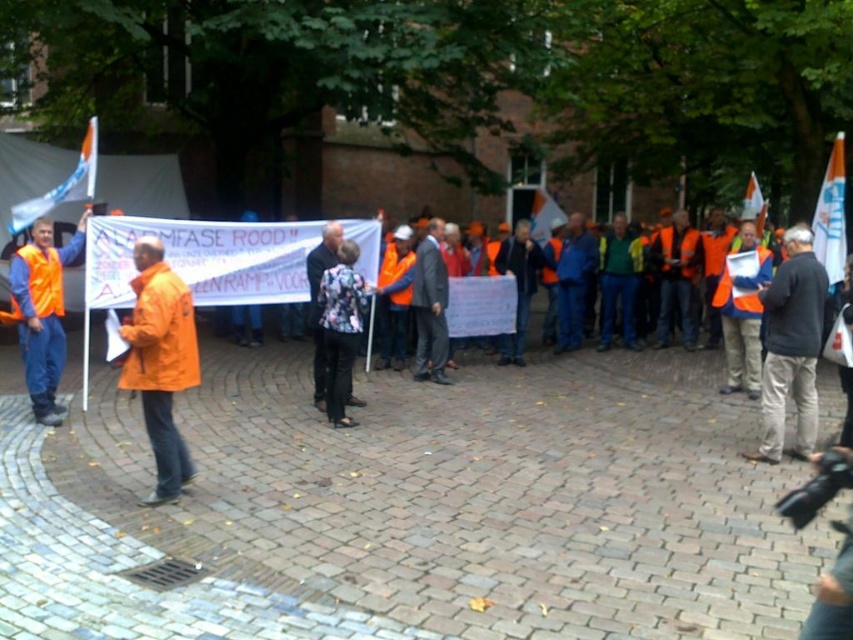
Question: Which is farther from the orange reflective vest at left?

Choices:
 (A) orange matte jacket at center
 (B) floral-patterned jacket at center
 (C) dark gray jacket at center

Answer: (C)

Question: Can you confirm if orange matte jacket at center is positioned to the right of orange reflective vest at left?

Choices:
 (A) yes
 (B) no

Answer: (A)

Question: Is orange matte jacket at center smaller than floral-patterned jacket at center?

Choices:
 (A) yes
 (B) no

Answer: (B)

Question: Which point appears farthest from the camera in this image?

Choices:
 (A) (775, 362)
 (B) (62, 262)
 (C) (743, 236)
 (D) (364, 288)

Answer: (C)

Question: Which of the following is the closest to the observer?

Choices:
 (A) orange matte jacket at center
 (B) dark gray jacket at center
 (C) orange reflective vest at left
 (D) floral-patterned jacket at center

Answer: (A)

Question: Can you confirm if orange matte jacket at center is bigger than orange reflective vest at left?

Choices:
 (A) no
 (B) yes

Answer: (A)